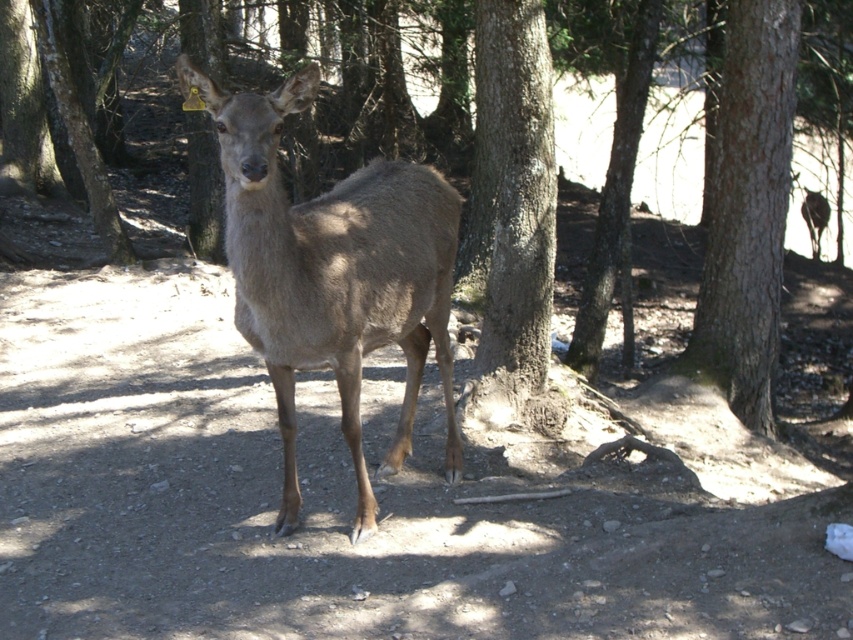
You are a photographer trying to capture a clear photo of the deer. You notice two trees in the background, the smooth bark tree at center and the brown rough tree at center. Which tree is closer to the camera and might block the view of the deer?

The smooth bark tree at center is in front of the brown rough tree at center, so it is closer to the camera and might block the view of the deer.

You are a photographer trying to capture a photo of the brown fur deer at center and the smooth bark tree at center. From your current position, which object is more to the left?

The brown fur deer at center is positioned on the left side of smooth bark tree at center, so it is more to the left.

You are a hiker trying to locate two points marked in the forest scene. The first point is at coordinate point(358, 433) and the second at point(730, 394). Which point is nearer to your current position?

Point(358, 433) is closer to the viewer than point(730, 394), so the first point is nearer to your current position.